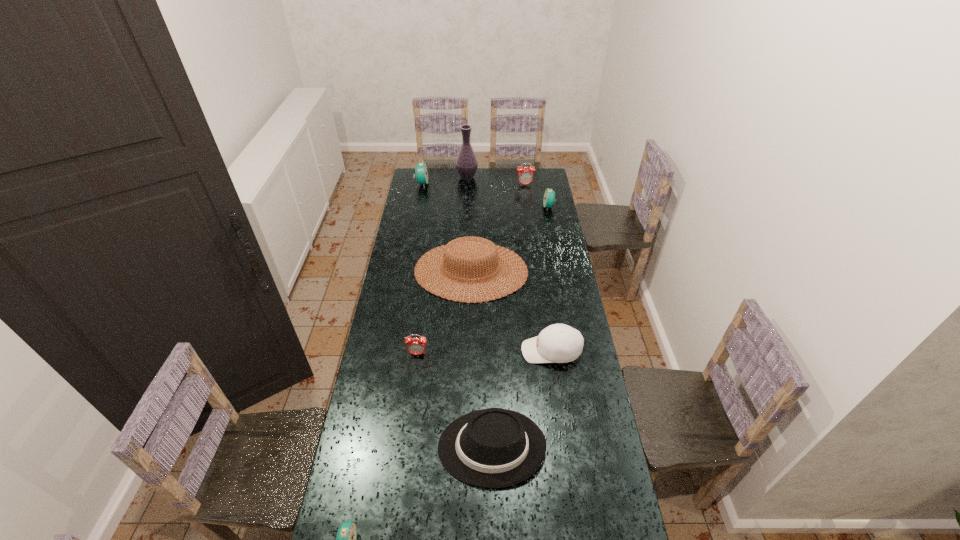
Where is `vase`? This screenshot has height=540, width=960. vase is located at coordinates (466, 163).

I want to click on the farthest blue alarm clock, so click(x=421, y=171).

This screenshot has height=540, width=960. Find the location of `the fourth alarm clock from left to right`. the fourth alarm clock from left to right is located at coordinates (525, 176).

At what (x,y) coordinates should I click in order to perform the action: click on the bigger red alarm clock. Please return your answer as a coordinate pair (x, y). The width and height of the screenshot is (960, 540). Looking at the image, I should click on (525, 176).

You are a GUI agent. You are given a task and a screenshot of the screen. Output one action in this format:
    pyautogui.click(x=<x>, y=<y>)
    Task: Click on the sunhat
    The height and width of the screenshot is (540, 960).
    Given the screenshot: What is the action you would take?
    pyautogui.click(x=454, y=248)

Where is `beige sunhat`? This screenshot has width=960, height=540. beige sunhat is located at coordinates (454, 248).

Image resolution: width=960 pixels, height=540 pixels. Identify the location of fedora. pos(490,448).

Find the location of a particular element. The width and height of the screenshot is (960, 540). baseball cap is located at coordinates (558, 343).

Find the location of a particular element. the third nearest alarm clock is located at coordinates (549, 196).

Locate an element on the screen. The width and height of the screenshot is (960, 540). the second smallest blue alarm clock is located at coordinates (549, 196).